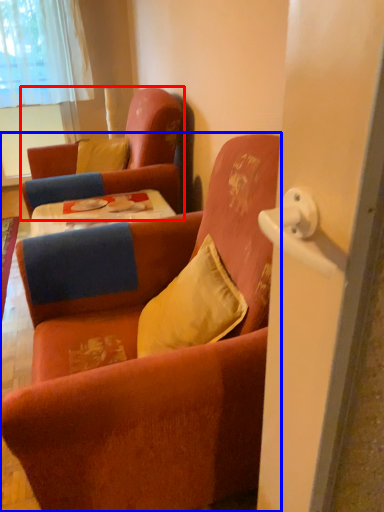
Question: Among these objects, which one is nearest to the camera, chair (highlighted by a red box) or chair (highlighted by a blue box)?

Choices:
 (A) chair
 (B) chair

Answer: (B)